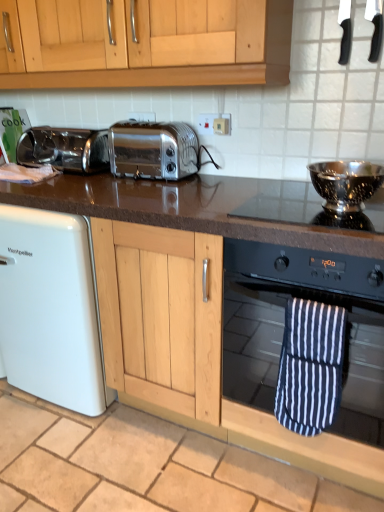
I want to click on free space in front of satin chrome toaster at center, the 1th toaster viewed from the left, so click(x=69, y=181).